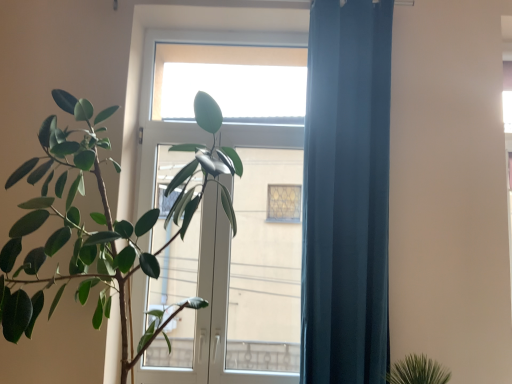
Question: Is point (312, 269) positioned closer to the camera than point (243, 81)?

Choices:
 (A) farther
 (B) closer

Answer: (B)

Question: Is dark blue fabric curtain at right wider or thinner than transparent glass window at upper center?

Choices:
 (A) thin
 (B) wide

Answer: (B)

Question: Which object is the closest to the dark blue fabric curtain at right?

Choices:
 (A) green matte plant at left
 (B) transparent glass screen door at center
 (C) transparent glass window at upper center

Answer: (A)

Question: Which object is the closest to the dark blue fabric curtain at right?

Choices:
 (A) transparent glass window at upper center
 (B) green matte plant at left
 (C) transparent glass screen door at center

Answer: (B)